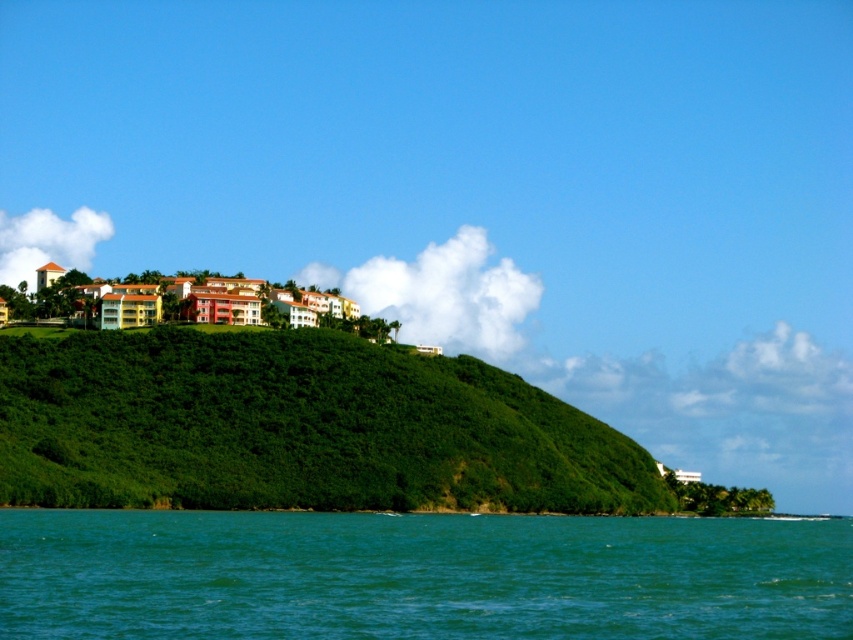
Can you confirm if teal glossy water at lower center is shorter than green leafy hillside at center?

Yes, teal glossy water at lower center is shorter than green leafy hillside at center.

Is point (196, 579) positioned before point (94, 506)?

Yes, it is in front of point (94, 506).

Describe the element at coordinates (419, 576) in the screenshot. I see `teal glossy water at lower center` at that location.

Identify the location of teal glossy water at lower center. (419, 576).